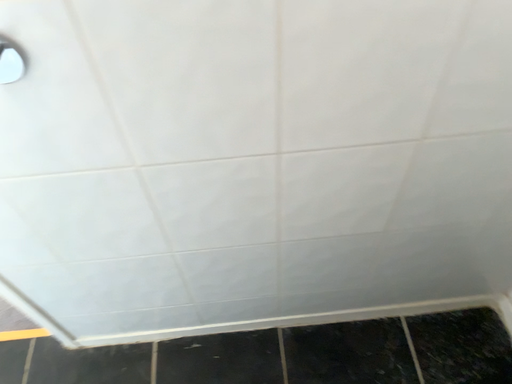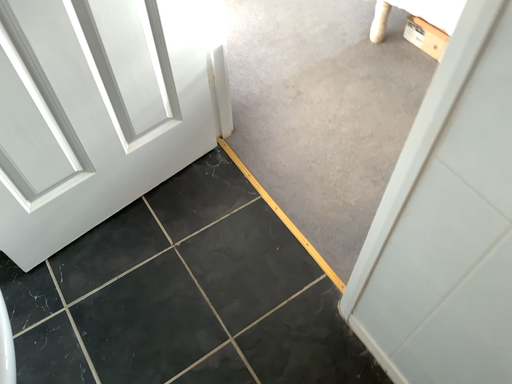
Question: How did the camera likely rotate when shooting the video?

Choices:
 (A) rotated left
 (B) rotated right

Answer: (A)